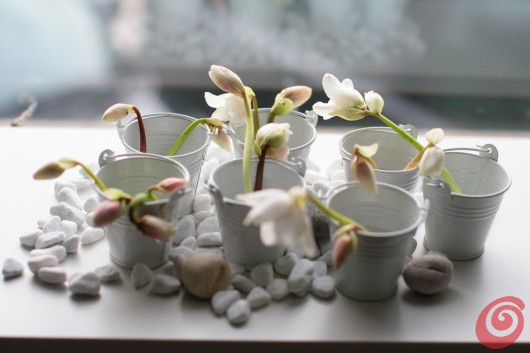
What are the coordinates of `decorative buckets` in the screenshot? It's located at (130, 175), (161, 127), (229, 176), (299, 130), (479, 174), (398, 151), (388, 210).